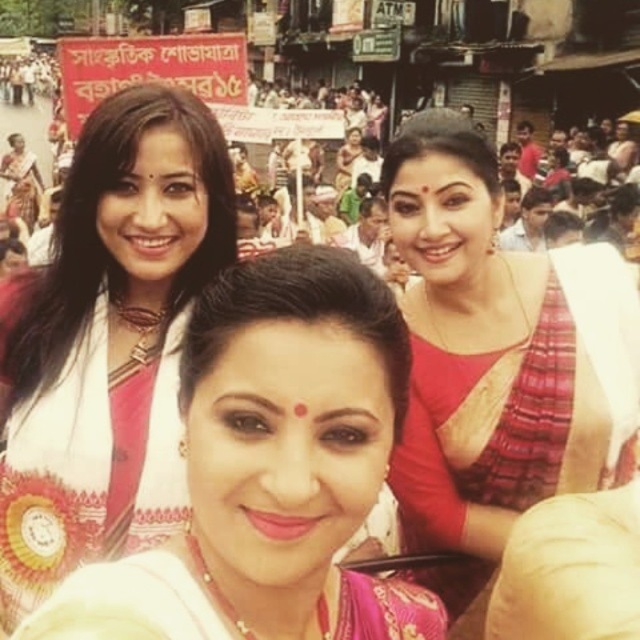
Question: Is matte white saree at upper left closer to the viewer compared to matte red saree at upper right?

Choices:
 (A) no
 (B) yes

Answer: (A)

Question: Which point is farther to the camera?

Choices:
 (A) pyautogui.click(x=144, y=627)
 (B) pyautogui.click(x=428, y=440)
 (C) pyautogui.click(x=96, y=237)

Answer: (B)

Question: Which point appears closest to the camera in this image?

Choices:
 (A) (310, 260)
 (B) (538, 444)

Answer: (A)

Question: Considering the real-world distances, which object is closest to the matte white saree at upper left?

Choices:
 (A) pink satin saree at center
 (B) matte red saree at upper right

Answer: (A)

Question: Does pink satin saree at center lie in front of matte red saree at upper right?

Choices:
 (A) yes
 (B) no

Answer: (A)

Question: Can you confirm if pink satin saree at center is bigger than matte white saree at upper left?

Choices:
 (A) yes
 (B) no

Answer: (A)